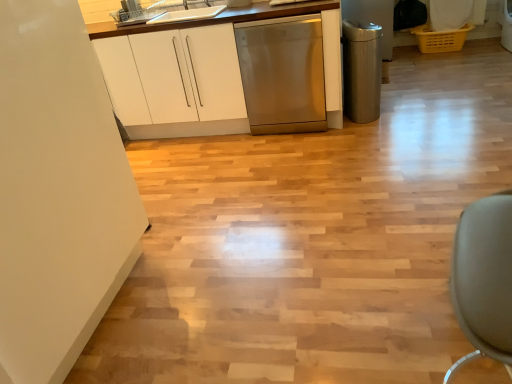
Identify the location of vacant area that lies in front of stainless steel dishwasher at center. (321, 152).